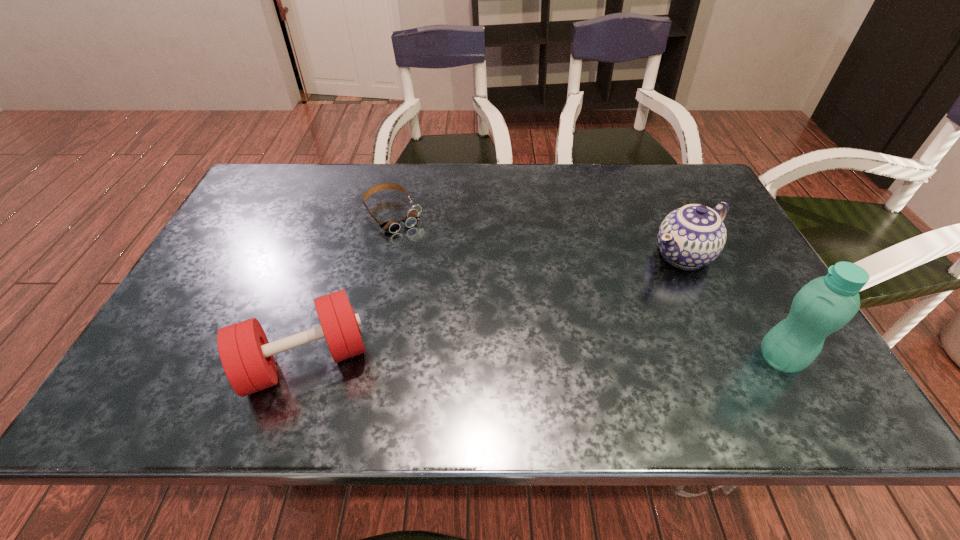
This screenshot has width=960, height=540. What are the coordinates of `vacant area that lies between the chinaware and the dumbbell` in the screenshot? It's located at coord(494,307).

Identify the location of vacant area between the chinaware and the dumbbell. The height and width of the screenshot is (540, 960). (494, 307).

Image resolution: width=960 pixels, height=540 pixels. What are the coordinates of `empty space that is in between the tallest object and the chinaware` in the screenshot? It's located at (732, 307).

Identify the location of object that can be found as the second closest to the bottle. (246, 355).

Where is `object that is the closest to the chinaware`? object that is the closest to the chinaware is located at coordinates (826, 304).

Find the location of `vacant area in the image that satisfies the following two spatial constraints: 1. on the front side of the chinaware; 2. on the left side of the goggles`. vacant area in the image that satisfies the following two spatial constraints: 1. on the front side of the chinaware; 2. on the left side of the goggles is located at coordinates (385, 254).

Locate an element on the screen. This screenshot has height=540, width=960. blank area in the image that satisfies the following two spatial constraints: 1. on the back side of the tallest object; 2. on the right side of the dumbbell is located at coordinates (306, 359).